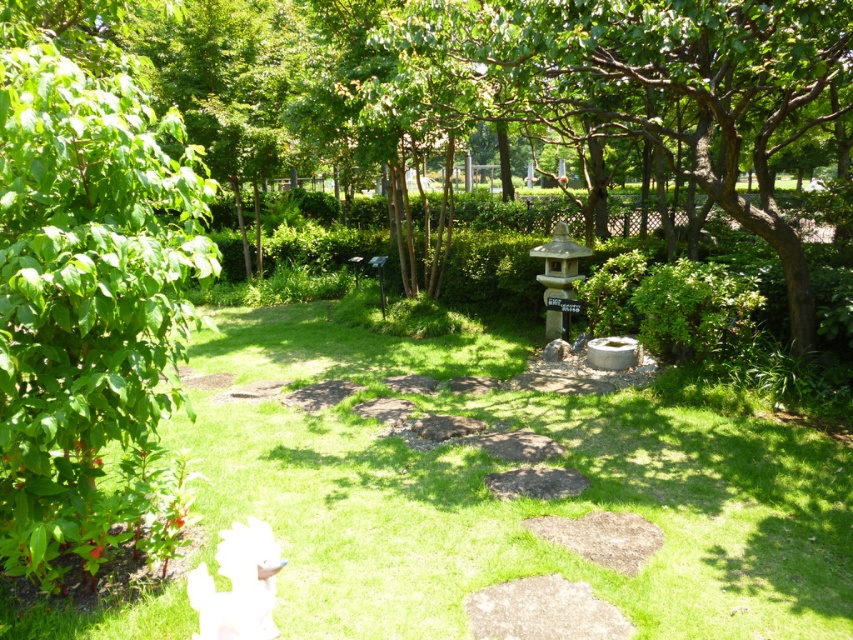
Question: Which object appears closest to the camera in this image?

Choices:
 (A) smooth stone lantern at center
 (B) green leafy tree at left
 (C) green grass at center

Answer: (B)

Question: Is green grass at center smaller than green leafy tree at left?

Choices:
 (A) yes
 (B) no

Answer: (A)

Question: Which object is positioned farthest from the green grass at center?

Choices:
 (A) green leafy tree at left
 (B) smooth stone lantern at center

Answer: (B)

Question: Estimate the real-world distances between objects in this image. Which object is closer to the smooth stone lantern at center?

Choices:
 (A) green grass at center
 (B) green leafy tree at left

Answer: (A)

Question: Does green grass at center appear on the left side of smooth stone lantern at center?

Choices:
 (A) no
 (B) yes

Answer: (B)

Question: Does green leafy tree at left have a greater width compared to smooth stone lantern at center?

Choices:
 (A) yes
 (B) no

Answer: (A)